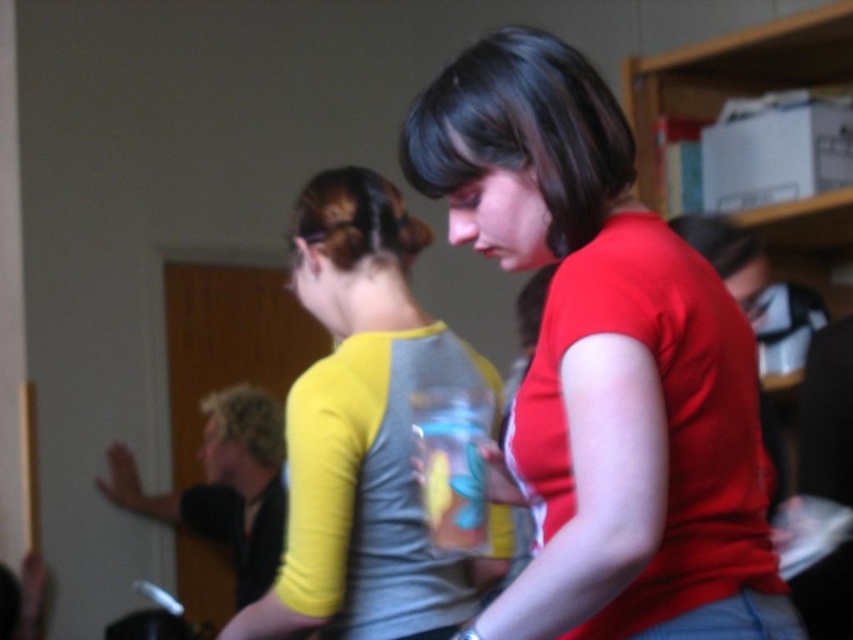
Question: Among these points, which one is farthest from the camera?

Choices:
 (A) (345, 401)
 (B) (560, 502)

Answer: (A)

Question: Is red matte shirt at center smaller than yellow-green t-shirt at center?

Choices:
 (A) no
 (B) yes

Answer: (A)

Question: Considering the relative positions of red matte shirt at center and yellow-green t-shirt at center in the image provided, where is red matte shirt at center located with respect to yellow-green t-shirt at center?

Choices:
 (A) below
 (B) above

Answer: (B)

Question: Which of the following is the farthest from the observer?

Choices:
 (A) 413,570
 (B) 693,394

Answer: (A)

Question: From the image, what is the correct spatial relationship of red matte shirt at center in relation to yellow-green t-shirt at center?

Choices:
 (A) above
 (B) below

Answer: (A)